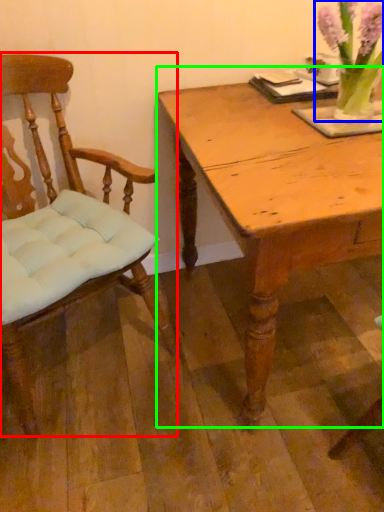
Question: Which object is the farthest from chair (highlighted by a red box)? Choose among these: floral arrangement (highlighted by a blue box) or table (highlighted by a green box).

Choices:
 (A) floral arrangement
 (B) table

Answer: (A)